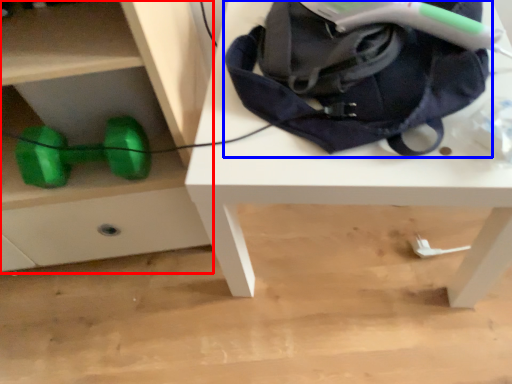
Question: Which object appears closest to the camera in this image, chest of drawers (highlighted by a red box) or bag (highlighted by a blue box)?

Choices:
 (A) chest of drawers
 (B) bag

Answer: (A)